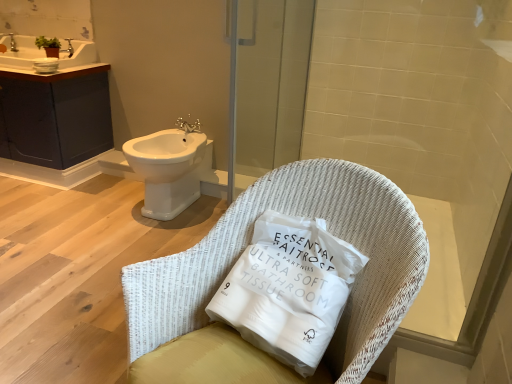
Locate an element on the screen. free space in front of white glossy bidet at left is located at coordinates (129, 238).